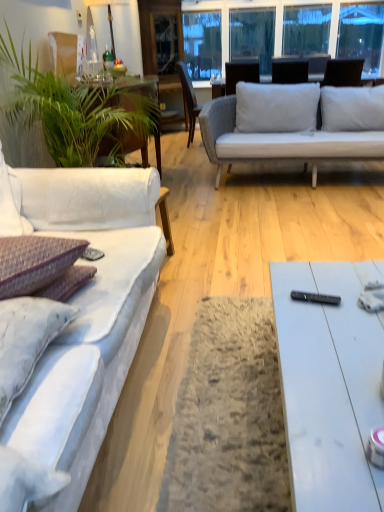
Question: Does black plastic remote control at center lie behind purple textured pillow at left?

Choices:
 (A) yes
 (B) no

Answer: (A)

Question: Is black plastic remote control at center to the left of purple textured pillow at left from the viewer's perspective?

Choices:
 (A) yes
 (B) no

Answer: (B)

Question: Is black plastic remote control at center to the right of purple textured pillow at left from the viewer's perspective?

Choices:
 (A) yes
 (B) no

Answer: (A)

Question: Is black plastic remote control at center facing away from purple textured pillow at left?

Choices:
 (A) yes
 (B) no

Answer: (B)

Question: Does black plastic remote control at center have a greater height compared to purple textured pillow at left?

Choices:
 (A) no
 (B) yes

Answer: (A)

Question: Is point (145, 159) closer or farther from the camera than point (312, 292)?

Choices:
 (A) farther
 (B) closer

Answer: (A)

Question: From a real-world perspective, is green leafy plant at left positioned above or below black plastic remote control at center?

Choices:
 (A) above
 (B) below

Answer: (A)

Question: Do you think green leafy plant at left is within black plastic remote control at center, or outside of it?

Choices:
 (A) outside
 (B) inside

Answer: (A)

Question: Is green leafy plant at left bigger or smaller than black plastic remote control at center?

Choices:
 (A) small
 (B) big

Answer: (B)

Question: Relative to light brown wooden chair at center, is black plastic remote control at center in front or behind?

Choices:
 (A) behind
 (B) front

Answer: (B)

Question: Which is correct: black plastic remote control at center is inside light brown wooden chair at center, or outside of it?

Choices:
 (A) outside
 (B) inside

Answer: (A)

Question: From a real-world perspective, is black plastic remote control at center above or below light brown wooden chair at center?

Choices:
 (A) below
 (B) above

Answer: (A)

Question: Visually, is black plastic remote control at center positioned to the left or to the right of light brown wooden chair at center?

Choices:
 (A) left
 (B) right

Answer: (B)

Question: Is transparent glass window screen at upper center wider or thinner than light brown wooden chair at center?

Choices:
 (A) thin
 (B) wide

Answer: (A)

Question: In terms of size, does transparent glass window screen at upper center appear bigger or smaller than light brown wooden chair at center?

Choices:
 (A) small
 (B) big

Answer: (B)